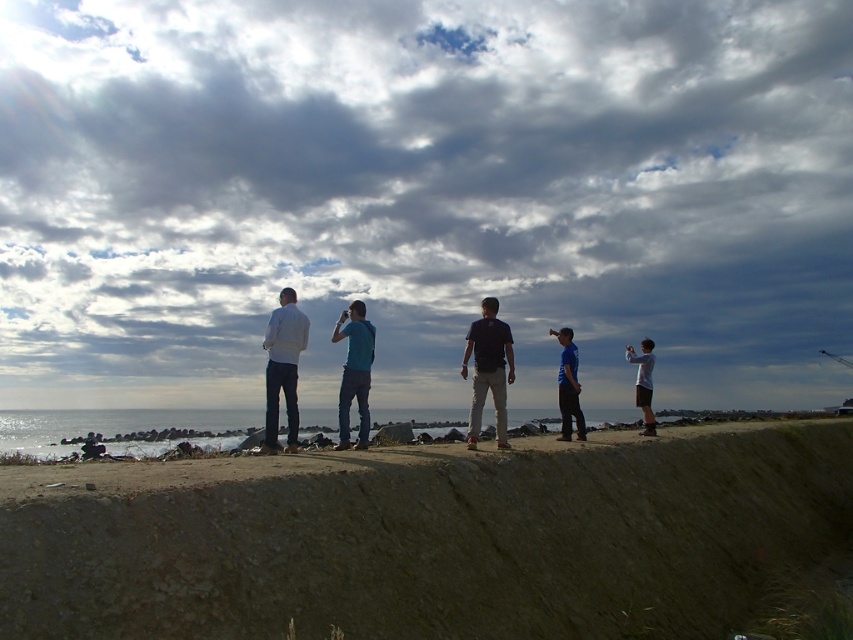
Question: Among these points, which one is nearest to the camera?

Choices:
 (A) (495, 346)
 (B) (271, 328)

Answer: (B)

Question: Does dark blue shirt at center appear on the right side of teal matte shirt at center?

Choices:
 (A) yes
 (B) no

Answer: (A)

Question: Which point is farther from the camera taking this photo?

Choices:
 (A) (300, 339)
 (B) (630, 348)
 (C) (567, 348)
 (D) (347, 337)

Answer: (B)

Question: Is smooth concrete cliff at lower center in front of white matte jacket at center?

Choices:
 (A) yes
 (B) no

Answer: (A)

Question: Is dark blue shirt at center further to the viewer compared to blue fabric shirt at center?

Choices:
 (A) no
 (B) yes

Answer: (A)

Question: Which point is farther to the camera?

Choices:
 (A) (466, 532)
 (B) (645, 365)

Answer: (B)